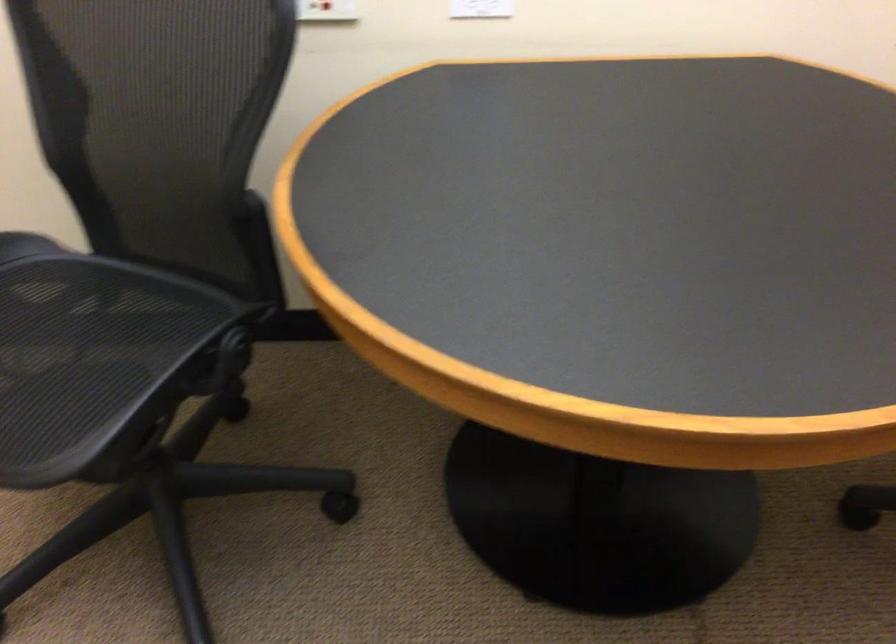
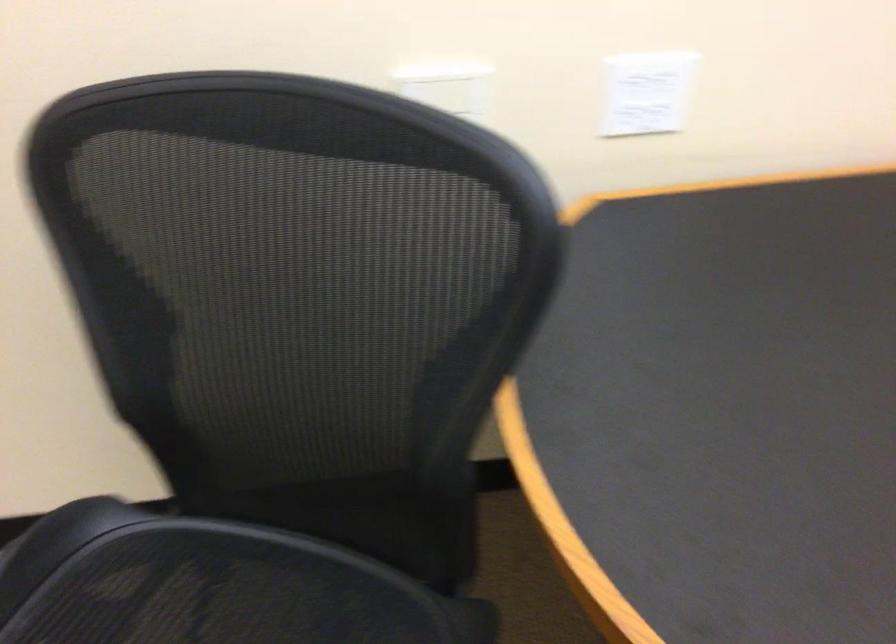
In a continuous first-person perspective shot, in which direction is the camera moving?

The cameraman moved toward left, forward.